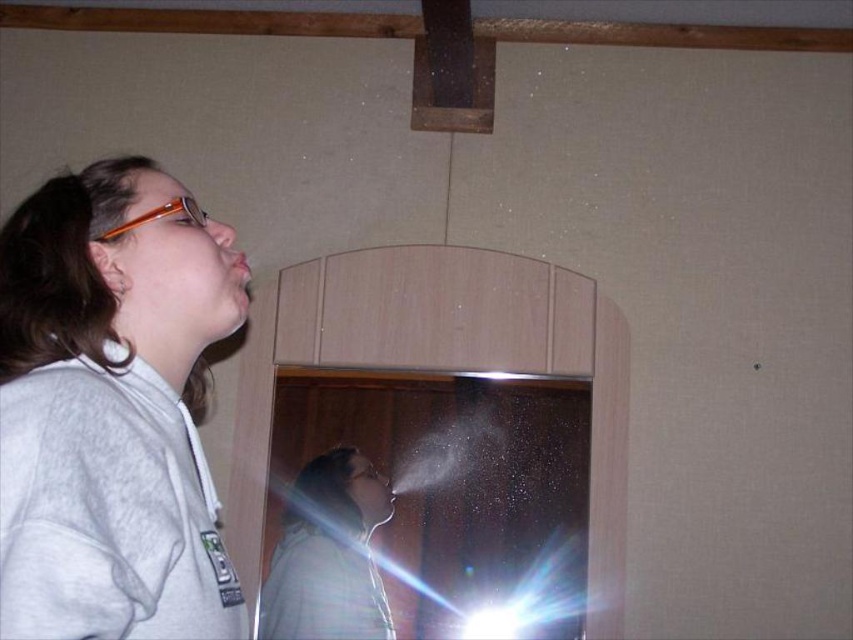
You are a fashion designer observing the image. You need to determine which piece of clothing is more prominent in the foreground. Which one is closer to the viewer between the gray fleece jacket at upper left and the matte gray shirt at center?

The gray fleece jacket at upper left is closer to the viewer than the matte gray shirt at center.

You are standing in the room and see a point at coordinates point (50, 195). If you move 86.68 centimeters towards the point, will you reach it?

Yes, because the distance between you and the point is exactly 86.68 centimeters, so moving that distance will bring you to the point.

You are a fashion designer who wants to create a layered outfit using the gray fleece jacket at upper left and the matte gray shirt at center. Based on their positions in the image, can you determine if the jacket is close enough to the shirt to suggest they are part of the same outfit?

The gray fleece jacket at upper left is 1.01 meters away from the matte gray shirt at center. Since the distance between them is minimal, it suggests they are part of the same outfit.